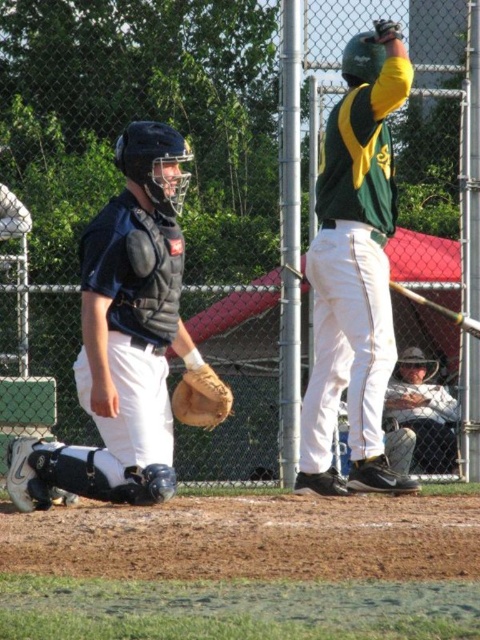
Question: Which point is closer to the camera taking this photo?

Choices:
 (A) (158, 456)
 (B) (195, 385)
 (C) (411, 381)

Answer: (A)

Question: Which point is closer to the camera?

Choices:
 (A) green matte jersey at center
 (B) matte black catcher's gear at left

Answer: (B)

Question: Estimate the real-world distances between objects in this image. Which object is closer to the white cotton shirt at lower right?

Choices:
 (A) green matte jersey at center
 (B) brown leather glove at lower left
 (C) matte black catcher's gear at left

Answer: (A)

Question: Does green matte jersey at center have a greater width compared to white cotton shirt at lower right?

Choices:
 (A) no
 (B) yes

Answer: (B)

Question: Considering the relative positions of green matte jersey at center and brown leather glove at lower left in the image provided, where is green matte jersey at center located with respect to brown leather glove at lower left?

Choices:
 (A) above
 (B) below

Answer: (A)

Question: Is matte black catcher's gear at left below white cotton shirt at lower right?

Choices:
 (A) yes
 (B) no

Answer: (B)